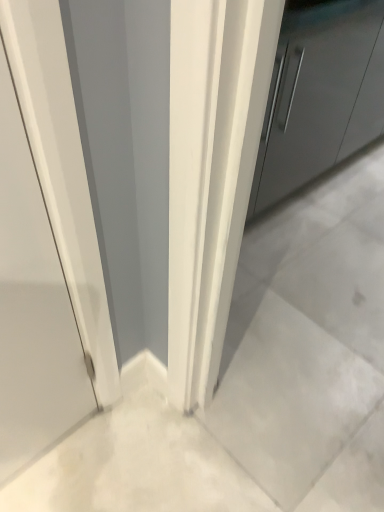
Describe the element at coordinates (32, 308) in the screenshot. This screenshot has height=512, width=384. I see `white glossy door at center` at that location.

Find the location of a particular element. white glossy door at center is located at coordinates (32, 308).

Where is `white glossy door at center`? white glossy door at center is located at coordinates (32, 308).